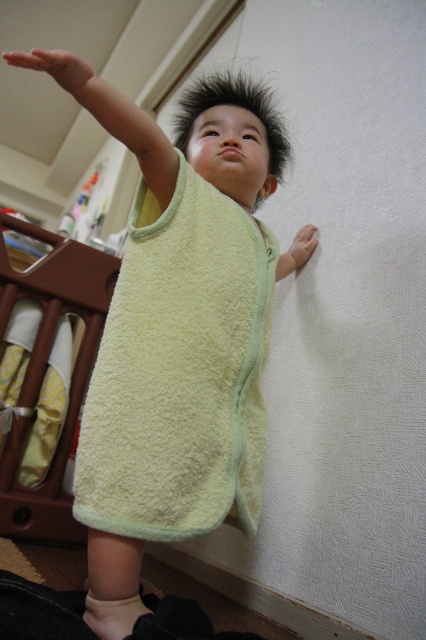
You are a parent trying to ensure your child stays within a safe distance from a fragile shelf nearby. The soft green towel at upper center is part of the child. Can you confirm if the child is within a 1 meter safety zone?

The soft green towel at upper center and viewer are 82.96 centimeters apart from each other, which is within the 1 meter safety zone. Therefore, the child is within the safe distance.

You are a parent trying to find your child in a nursery. You see the point marked at coordinates (45, 369). What object is located at that point?

The point at coordinates (45, 369) corresponds to the brown wood texture infant bed at lower left.